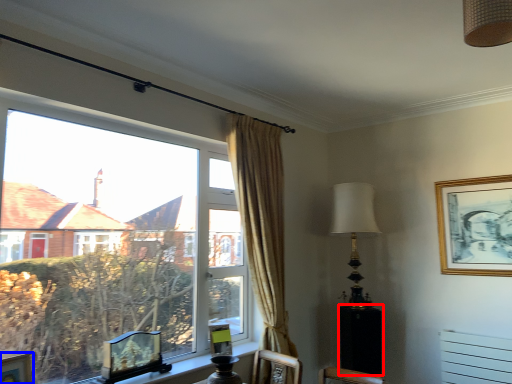
Question: Which object is further to the camera taking this photo, side table (highlighted by a red box) or picture frame (highlighted by a blue box)?

Choices:
 (A) side table
 (B) picture frame

Answer: (A)